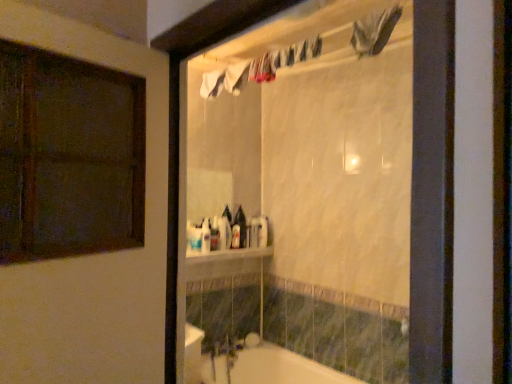
Where is `empty space that is ontop of white glossy shelf at center (from a real-world perspective)`? This screenshot has width=512, height=384. empty space that is ontop of white glossy shelf at center (from a real-world perspective) is located at coordinates (232, 247).